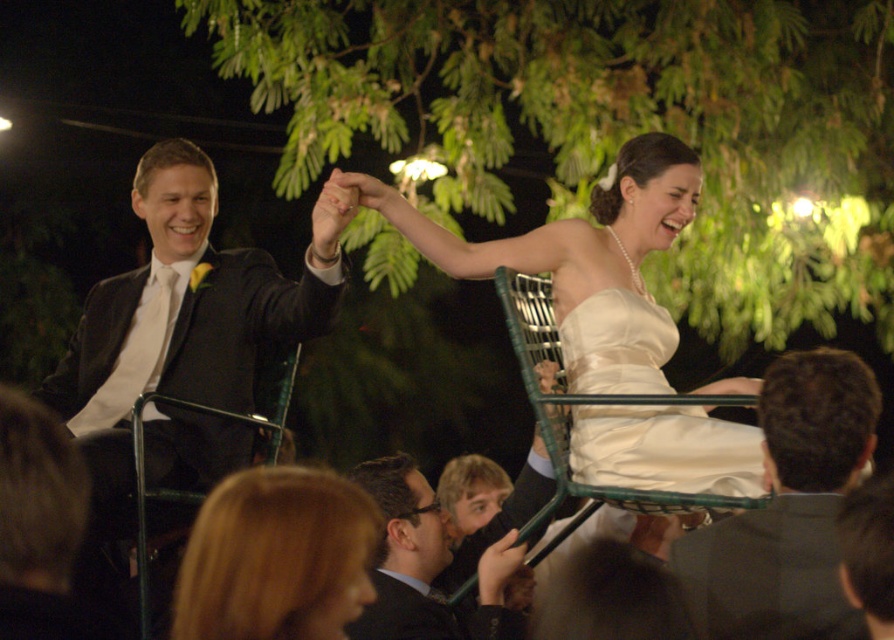
Question: Can you confirm if matte black suit at left is positioned to the left of blonde hair at lower left?

Choices:
 (A) no
 (B) yes

Answer: (B)

Question: Estimate the real-world distances between objects in this image. Which object is farther from the dark gray suit at lower right?

Choices:
 (A) blonde hair at lower left
 (B) dark brown suit at lower center

Answer: (B)

Question: Which point is closer to the camera taking this photo?

Choices:
 (A) (156, 502)
 (B) (774, 442)

Answer: (B)

Question: In this image, where is ivory satin dress at center located relative to dark gray suit at lower right?

Choices:
 (A) above
 (B) below

Answer: (A)

Question: Does blonde hair at lower left lie in front of satin white dress at center?

Choices:
 (A) yes
 (B) no

Answer: (A)

Question: Which of these objects is positioned farthest from the blonde hair at lower left?

Choices:
 (A) satin white dress at center
 (B) dark gray suit at lower right

Answer: (A)